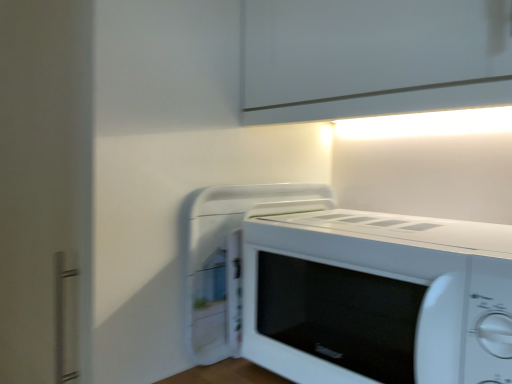
Question: Does point (234, 321) appear closer or farther from the camera than point (318, 208)?

Choices:
 (A) closer
 (B) farther

Answer: (A)

Question: Is white plastic microwave at center bigger or smaller than white matte microwave at center?

Choices:
 (A) big
 (B) small

Answer: (B)

Question: Based on their positions, is white plastic microwave at center located to the left or right of white matte microwave at center?

Choices:
 (A) right
 (B) left

Answer: (B)

Question: Considering the positions of white matte microwave at center and white plastic microwave at center in the image, is white matte microwave at center bigger or smaller than white plastic microwave at center?

Choices:
 (A) big
 (B) small

Answer: (A)

Question: Would you say white matte microwave at center is to the left or to the right of white plastic microwave at center in the picture?

Choices:
 (A) right
 (B) left

Answer: (A)

Question: Considering the positions of point (458, 324) and point (236, 319), is point (458, 324) closer or farther from the camera than point (236, 319)?

Choices:
 (A) farther
 (B) closer

Answer: (B)

Question: From a real-world perspective, is white matte microwave at center positioned above or below white plastic microwave at center?

Choices:
 (A) above
 (B) below

Answer: (B)